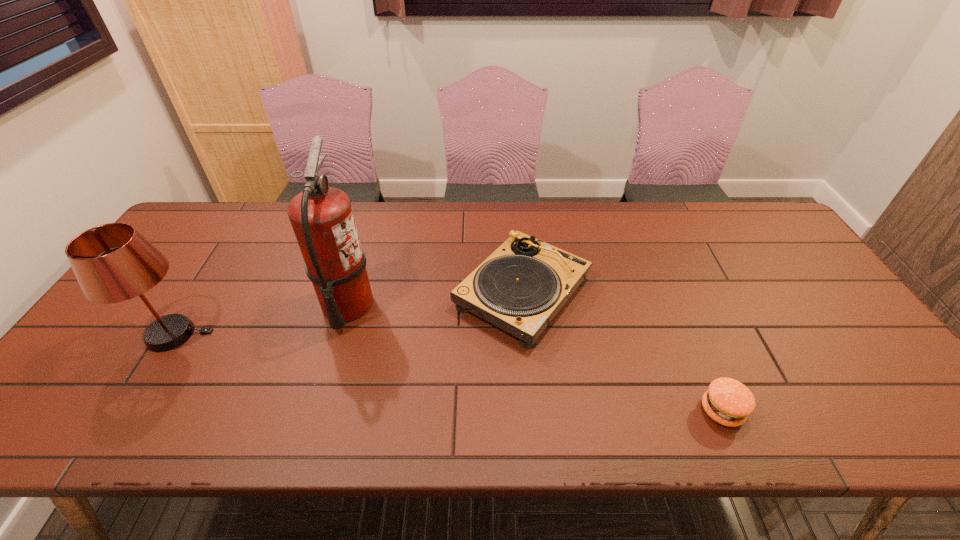
Locate an element on the screen. The image size is (960, 540). the second object from left to right is located at coordinates (322, 218).

Find the location of a particular element. The image size is (960, 540). fire extinguisher is located at coordinates (322, 218).

This screenshot has width=960, height=540. I want to click on the second tallest object, so click(113, 262).

Where is `lampshade`? Image resolution: width=960 pixels, height=540 pixels. lampshade is located at coordinates (113, 262).

Locate an element on the screen. Image resolution: width=960 pixels, height=540 pixels. the second shortest object is located at coordinates (522, 285).

Find the location of a particular element. The image size is (960, 540). the second object from right to left is located at coordinates (522, 285).

The width and height of the screenshot is (960, 540). In order to click on the rightmost object in this screenshot , I will do `click(728, 402)`.

The image size is (960, 540). In order to click on the nearest object in this screenshot , I will do `click(728, 402)`.

Find the location of `free location located 0.110m toward the nozzle of the tallest object`. free location located 0.110m toward the nozzle of the tallest object is located at coordinates (415, 305).

Image resolution: width=960 pixels, height=540 pixels. I want to click on vacant space located on the front-facing side of the leftmost object, so click(294, 334).